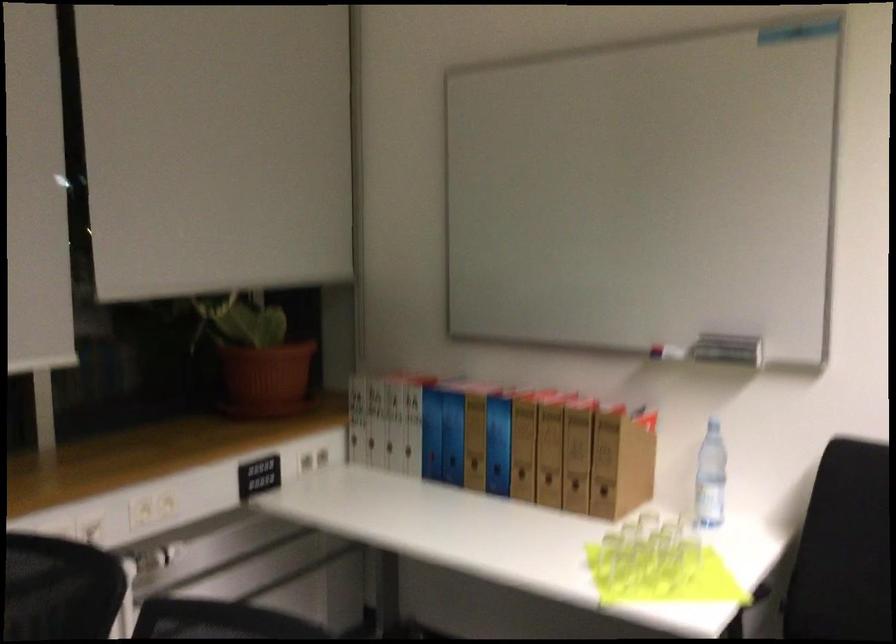
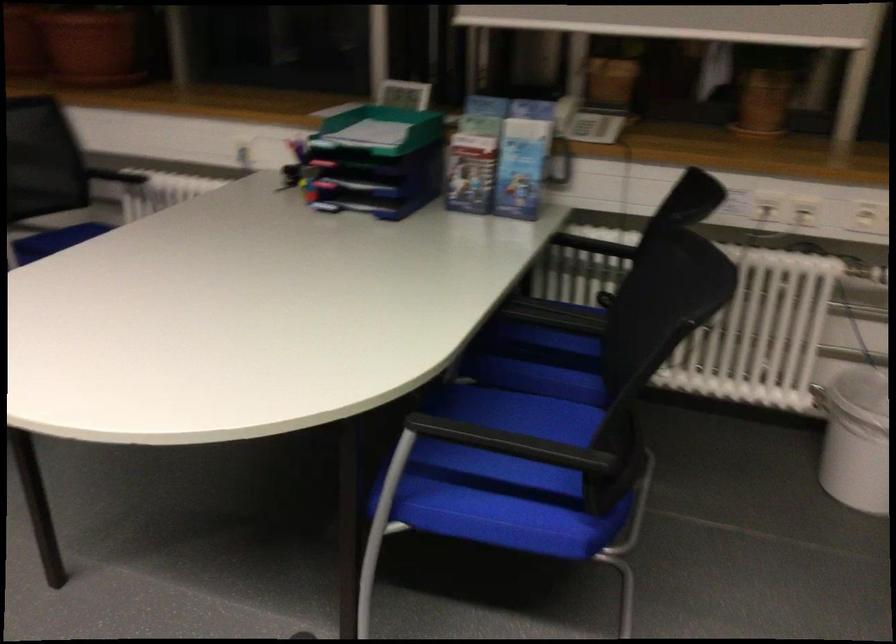
The first image is from the beginning of the video and the second image is from the end. How did the camera likely rotate when shooting the video?

The rotation direction of the camera is left-down.